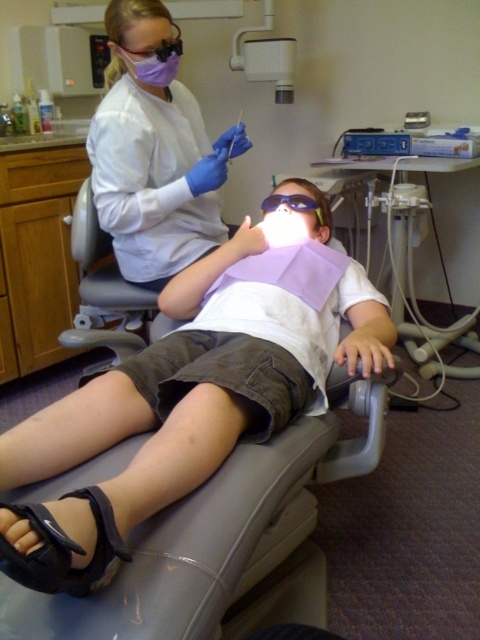
Question: Which point is closer to the camera?

Choices:
 (A) white plastic dental chair at right
 (B) blue matte goggles at center
 (C) purple fabric mask at upper left

Answer: (C)

Question: Which of the following is the closest to the observer?

Choices:
 (A) (312, 202)
 (B) (158, 42)
 (C) (462, 157)
 (D) (158, 422)

Answer: (D)

Question: Is the position of white matte bib at center more distant than that of purple fabric mask at upper left?

Choices:
 (A) yes
 (B) no

Answer: (B)

Question: Which object appears farthest from the camera in this image?

Choices:
 (A) white plastic dental chair at right
 (B) blue matte goggles at center
 (C) purple fabric mask at upper left
 (D) white matte bib at center

Answer: (A)

Question: Does white matte bib at center appear over purple fabric mask at upper left?

Choices:
 (A) yes
 (B) no

Answer: (B)

Question: Is the position of white matte bib at center less distant than that of purple fabric mask at upper left?

Choices:
 (A) no
 (B) yes

Answer: (B)